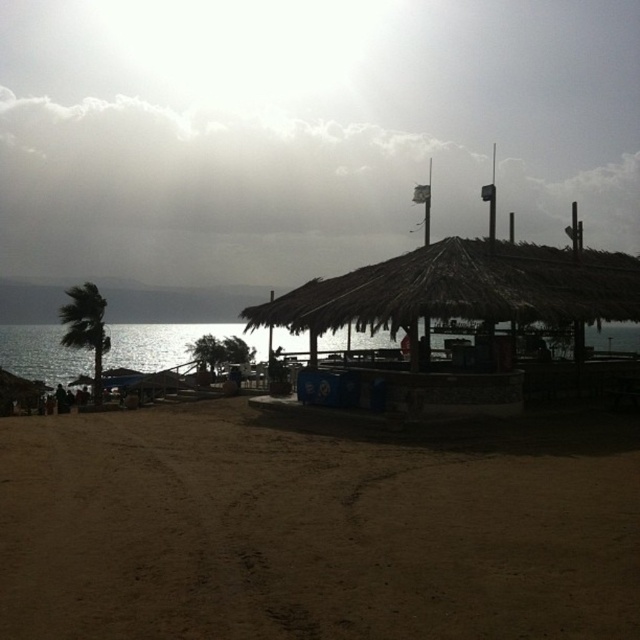
You are standing on the brown sandy beach at lower left and want to walk towards the green leafy palm tree at left. Which direction should you face to move closer to the tree?

Since the brown sandy beach at lower left is closer to the viewer than the green leafy palm tree at left, you should face towards the left direction to move closer to the tree.